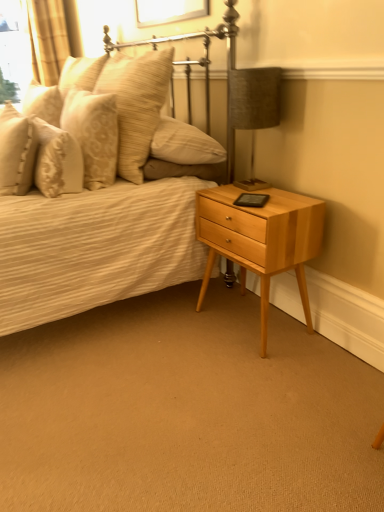
Question: From a real-world perspective, is textured fabric lampshade at upper right above or below matte beige bed at center?

Choices:
 (A) below
 (B) above

Answer: (B)

Question: Relative to matte beige bed at center, is textured fabric lampshade at upper right in front or behind?

Choices:
 (A) behind
 (B) front

Answer: (A)

Question: Which object is the farthest from the patterned fabric pillow at upper left, the third pillow positioned from the left?

Choices:
 (A) matte beige pillow at upper left, the first pillow viewed from the left
 (B) light wood/finely finished nightstand at lower right
 (C) beige textured pillow at left, which appears as the third pillow when viewed from the right
 (D) golden textured curtain at upper left
 (E) soft beige pillow at upper left, which is the first pillow from right to left

Answer: (D)

Question: Which is farther from the matte beige pillow at upper left, which appears as the fourth pillow when viewed from the right?

Choices:
 (A) soft beige pillow at upper left, positioned as the fourth pillow in left-to-right order
 (B) textured fabric lampshade at upper right
 (C) patterned fabric pillow at upper left, the third pillow positioned from the left
 (D) beige textured pillow at left, acting as the 2th pillow starting from the left
 (E) light wood/finely finished nightstand at lower right

Answer: (E)